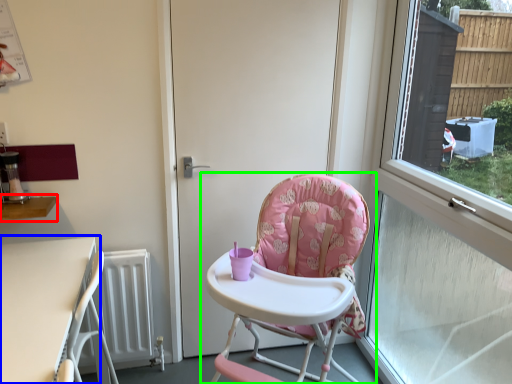
Question: Based on their relative distances, which object is farther from table (highlighted by a red box)? Choose from table (highlighted by a blue box) and chair (highlighted by a green box).

Choices:
 (A) table
 (B) chair

Answer: (B)